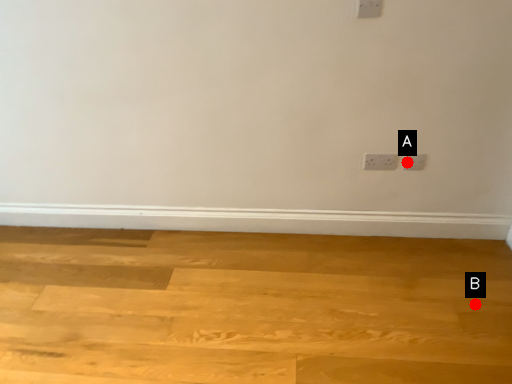
Question: Two points are circled on the image, labeled by A and B beside each circle. Which point appears farthest from the camera in this image?

Choices:
 (A) A is further
 (B) B is further

Answer: (A)